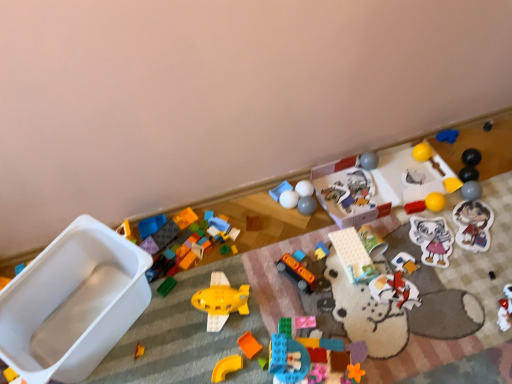
The width and height of the screenshot is (512, 384). In order to click on vacant space situated on the left part of orange plastic block at lower left, acting as the 23th toy starting from the right in this screenshot , I will do `click(100, 355)`.